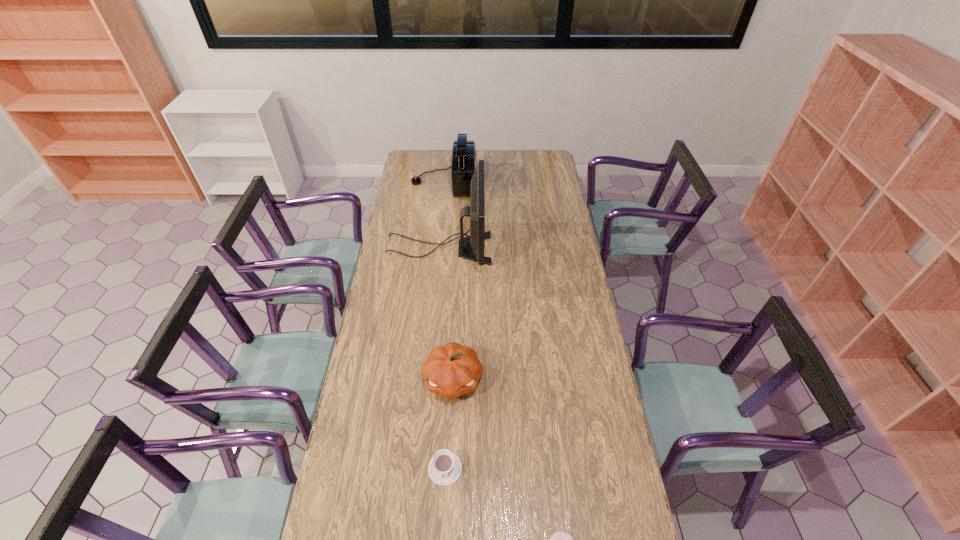
You are a GUI agent. You are given a task and a screenshot of the screen. Output one action in this format:
    pyautogui.click(x=<x>, y=<y>)
    Task: Click on the vacant space that's between the farthest object and the third shortest object
    This screenshot has width=960, height=540.
    Given the screenshot: What is the action you would take?
    pyautogui.click(x=448, y=280)

Where is `empty location between the pumpkin and the fourth nearest object`? empty location between the pumpkin and the fourth nearest object is located at coordinates (446, 314).

Where is `empty space between the radio receiver and the tallest object`? The image size is (960, 540). empty space between the radio receiver and the tallest object is located at coordinates tap(442, 215).

You are a GUI agent. You are given a task and a screenshot of the screen. Output one action in this format:
    pyautogui.click(x=<x>, y=<y>)
    Task: Click on the third closest object to the fourth tallest object
    This screenshot has height=540, width=960.
    Given the screenshot: What is the action you would take?
    pyautogui.click(x=475, y=242)

Select which object appears as the closest to the second farthest object. Please provide its 2D coordinates. Your answer should be formatted as a tuple, i.e. [(x, y)], where the tuple contains the x and y coordinates of a point satisfying the conditions above.

[(464, 152)]